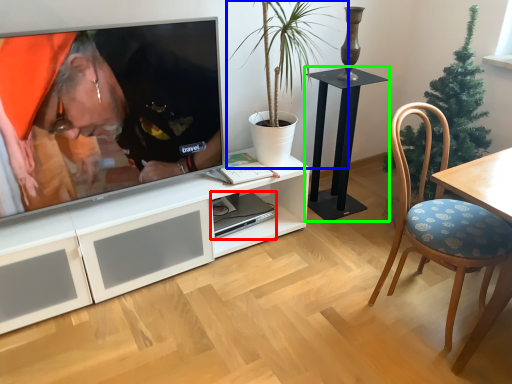
Question: Estimate the real-world distances between objects in this image. Which object is closer to computer (highlighted by a red box), houseplant (highlighted by a blue box) or table (highlighted by a green box)?

Choices:
 (A) houseplant
 (B) table

Answer: (B)